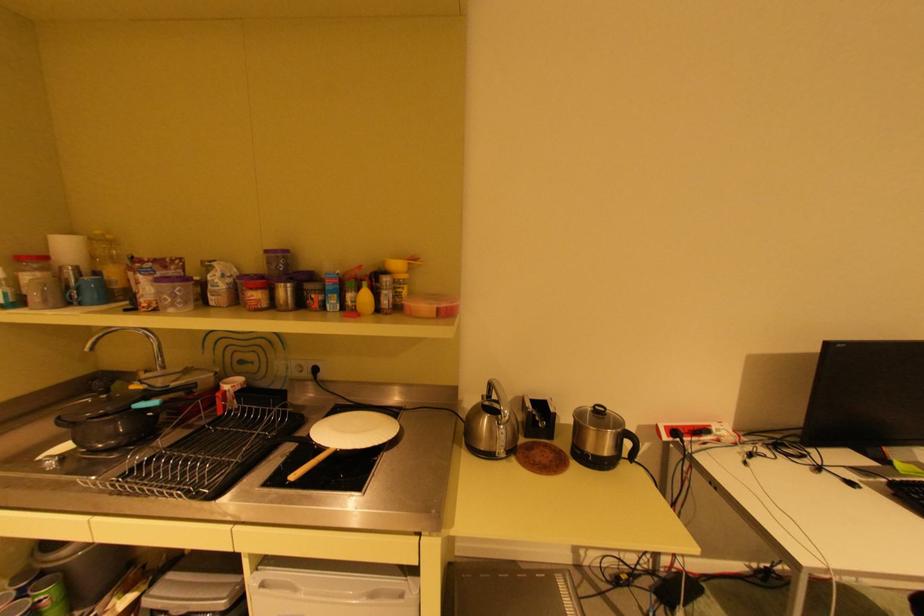
This screenshot has width=924, height=616. What do you see at coordinates (309, 464) in the screenshot?
I see `a wooden pan handle` at bounding box center [309, 464].